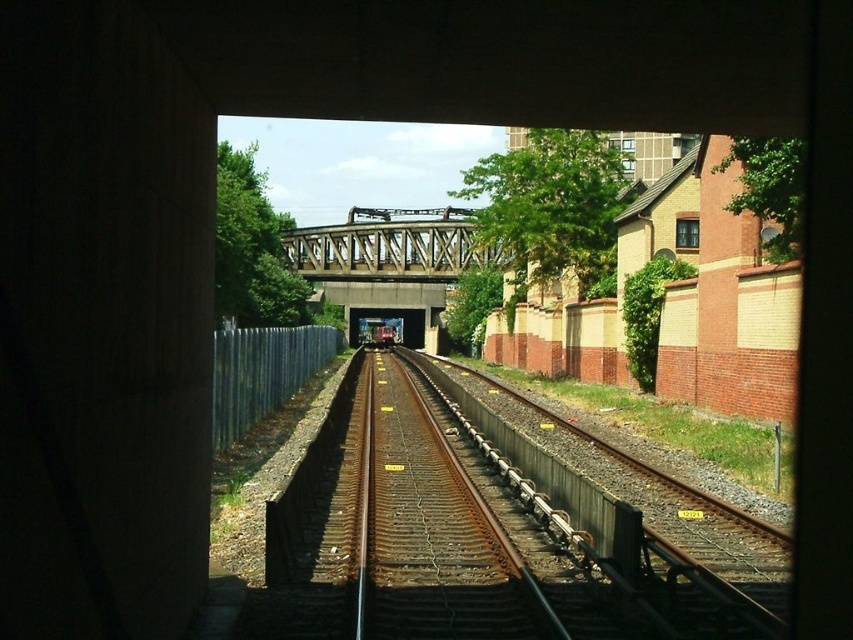
Question: Which of these objects is positioned closest to the rusty metal train track at center?

Choices:
 (A) metallic gray bridge at center
 (B) metallic train at center

Answer: (A)

Question: Among these objects, which one is nearest to the camera?

Choices:
 (A) galvanized metal fence at center
 (B) rusty metal train track at center
 (C) metallic gray bridge at center
 (D) metallic train at center

Answer: (B)

Question: Is rusty metal train track at center thinner than shiny silver train at center?

Choices:
 (A) yes
 (B) no

Answer: (A)

Question: Does galvanized metal fence at center appear under metallic train at center?

Choices:
 (A) no
 (B) yes

Answer: (B)

Question: Is rusty metal train track at center to the left of galvanized metal fence at center from the viewer's perspective?

Choices:
 (A) yes
 (B) no

Answer: (B)

Question: Which point is closer to the camera taking this photo?

Choices:
 (A) (320, 257)
 (B) (474, 502)
 (C) (373, 308)

Answer: (B)